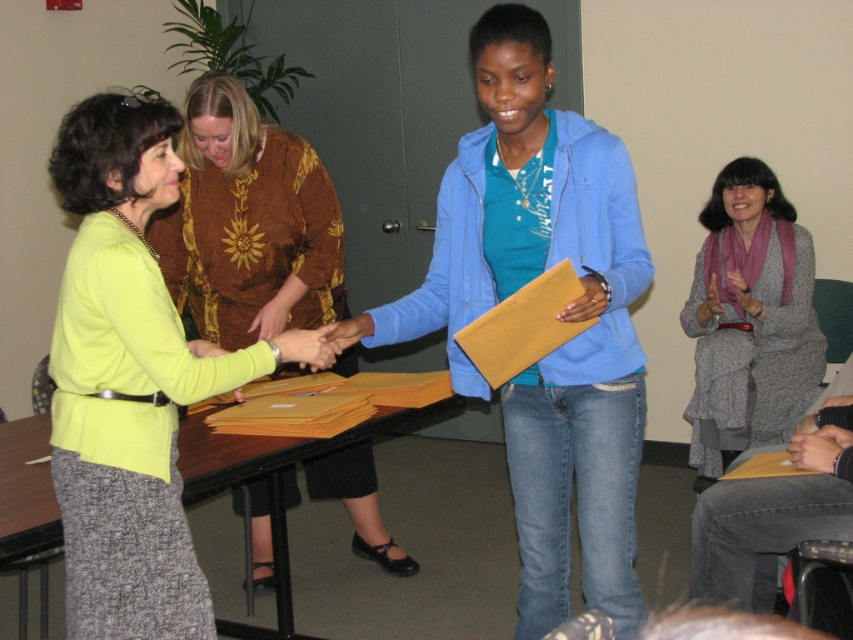
You are organizing a clothing donation drive and need to decide which items can fit into a standard donation bin. The bin can only accommodate items wider than 20 inches. Based on the scene, which of the two items, the blue matte jacket at center or the gray woolen sweater at upper right, is more likely to fit into the bin?

The blue matte jacket at center has a greater width than the gray woolen sweater at upper right. Since the bin requires items wider than 20 inches, the blue matte jacket at center is more likely to fit into the bin if its width exceeds the minimum requirement.

You are a delivery person who needs to place a package on the wooden table at center. You are currently standing next to the gray woolen sweater at upper right. Can you reach the table without moving more than 5 feet?

The gray woolen sweater at upper right and wooden table at center are 4.98 feet apart, so yes, you can reach the wooden table at center without moving more than 5 feet since the distance is just under the limit.

You are organizing a photo shoot and need to ensure proper lighting. Since the blue matte jacket at center and the gray woolen sweater at upper right are important subjects, which one should you focus the spotlight on first to ensure it doesn

The blue matte jacket at center should be focused on first because it is in front of the gray woolen sweater at upper right, making it more prominent in the foreground.